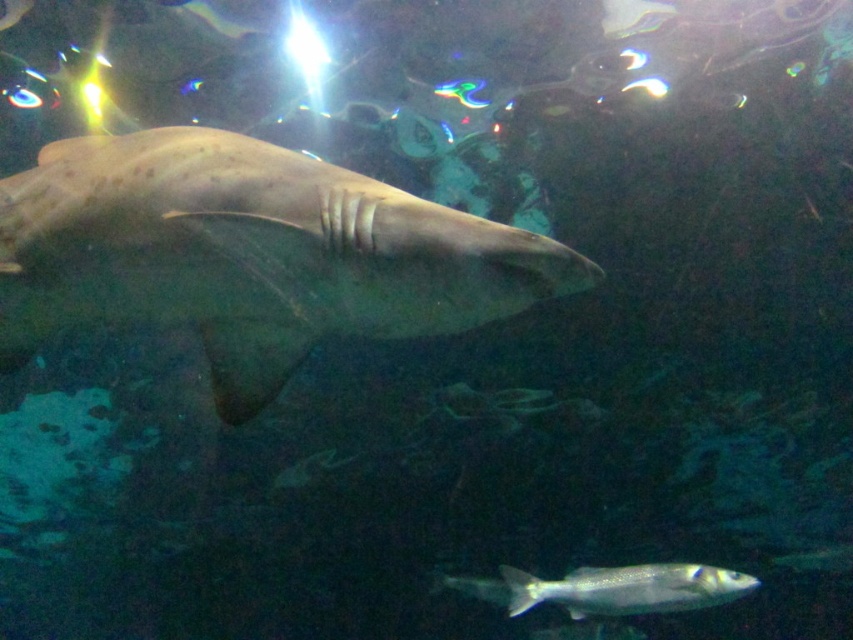
Question: Is speckled tan shark at center to the right of shiny silver fish at bottom right from the viewer's perspective?

Choices:
 (A) no
 (B) yes

Answer: (A)

Question: Which of the following is the farthest from the observer?

Choices:
 (A) (408, 193)
 (B) (650, 588)

Answer: (B)

Question: Can you confirm if speckled tan shark at center is positioned below shiny silver fish at bottom right?

Choices:
 (A) no
 (B) yes

Answer: (A)

Question: Observing the image, what is the correct spatial positioning of speckled tan shark at center in reference to shiny silver fish at bottom right?

Choices:
 (A) right
 (B) left

Answer: (B)